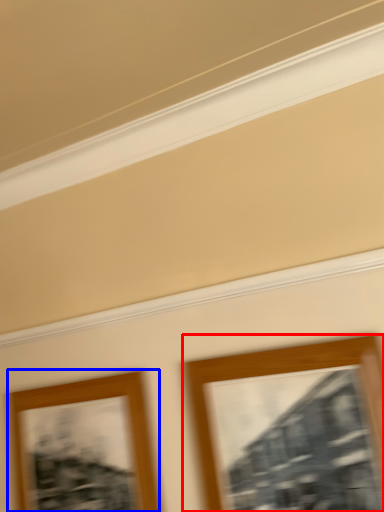
Question: Which object is closer to the camera taking this photo, picture frame (highlighted by a red box) or picture frame (highlighted by a blue box)?

Choices:
 (A) picture frame
 (B) picture frame

Answer: (A)